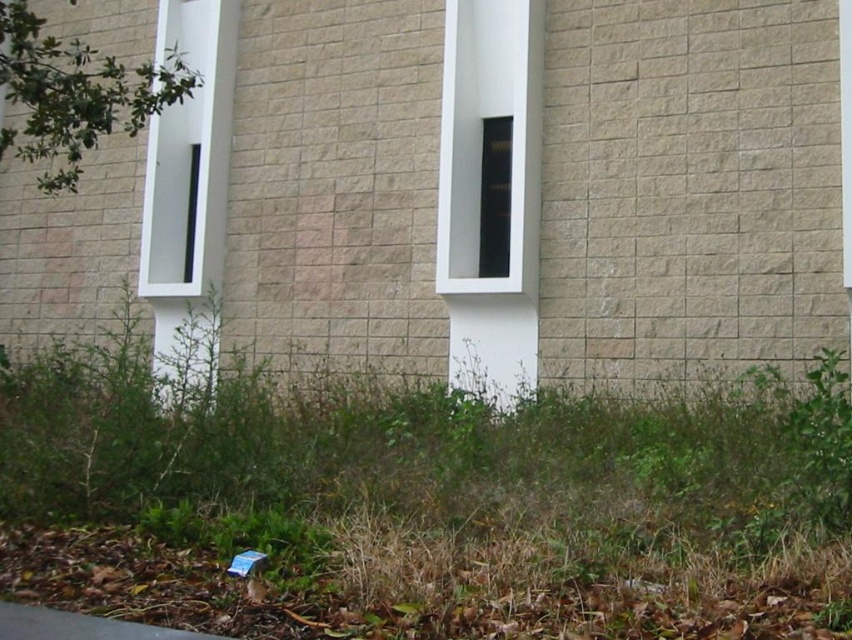
Question: Among these points, which one is nearest to the camera?

Choices:
 (A) (134, 506)
 (B) (470, 259)

Answer: (A)

Question: Which is nearer to the white glossy window at center?

Choices:
 (A) white glossy window at left
 (B) green grass at lower center
 (C) green leafy plant at upper left

Answer: (A)

Question: Is white glossy window at center below green leafy plant at upper left?

Choices:
 (A) yes
 (B) no

Answer: (A)

Question: Which point is farther from the camera taking this photo?

Choices:
 (A) (177, 166)
 (B) (468, 420)
 (C) (50, 170)
 (D) (532, 189)

Answer: (C)

Question: Can you confirm if white glossy window at center is thinner than white glossy window at left?

Choices:
 (A) no
 (B) yes

Answer: (A)

Question: Does white glossy window at center have a lesser width compared to green leafy plant at upper left?

Choices:
 (A) yes
 (B) no

Answer: (A)